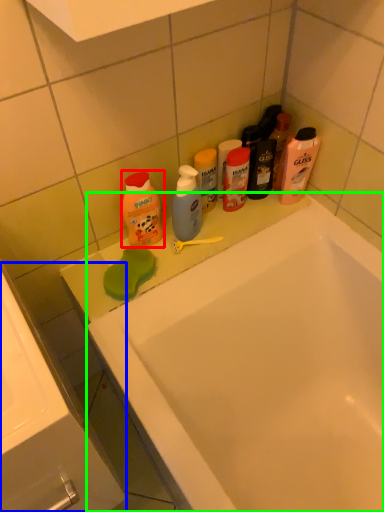
Question: Which object is the farthest from cleaning product (highlighted by a red box)? Choose among these: sink (highlighted by a blue box) or bathtub (highlighted by a green box).

Choices:
 (A) sink
 (B) bathtub

Answer: (A)